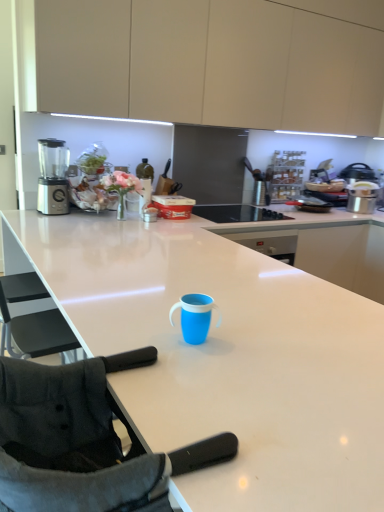
This screenshot has height=512, width=384. In order to click on vacant region to the left of blue plastic sippy cup at center in this screenshot , I will do `click(123, 329)`.